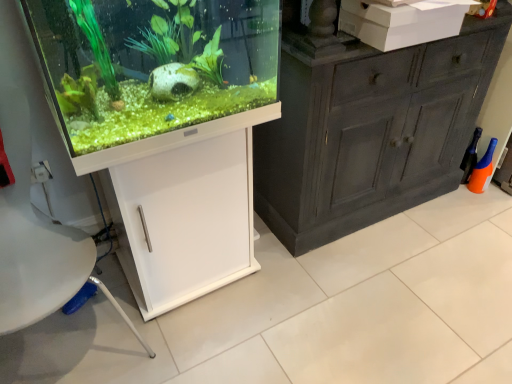
Where is `vacant area located to the right-hand side of white matte cabinet at lower left`? The height and width of the screenshot is (384, 512). vacant area located to the right-hand side of white matte cabinet at lower left is located at coordinates (292, 279).